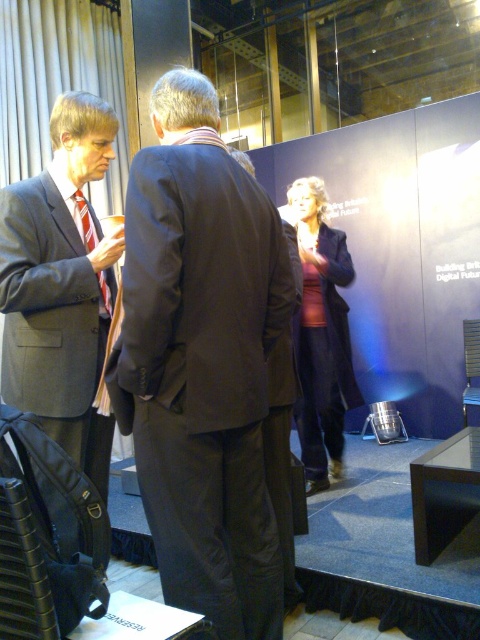
Question: From the image, what is the correct spatial relationship of matte gray suit at left in relation to red striped tie at left?

Choices:
 (A) below
 (B) above

Answer: (A)

Question: Estimate the real-world distances between objects in this image. Which object is closer to the red striped tie at left?

Choices:
 (A) matte gray suit at left
 (B) dark gray suit at center

Answer: (A)

Question: Which is farther from the dark gray suit at center?

Choices:
 (A) red striped tie at left
 (B) matte gray suit at left

Answer: (A)

Question: Can you confirm if matte gray suit at left is wider than red striped tie at left?

Choices:
 (A) no
 (B) yes

Answer: (B)

Question: Which point is farther to the camera?

Choices:
 (A) (11, 323)
 (B) (85, 250)
 (C) (244, 250)

Answer: (B)

Question: Observing the image, what is the correct spatial positioning of matte gray suit at left in reference to red striped tie at left?

Choices:
 (A) left
 (B) right

Answer: (A)